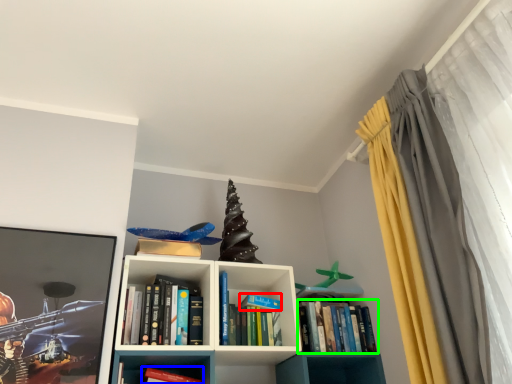
Question: Which is nearer to the paperback book (highlighted by a red box)? book (highlighted by a blue box) or book (highlighted by a green box).

Choices:
 (A) book
 (B) book

Answer: (B)